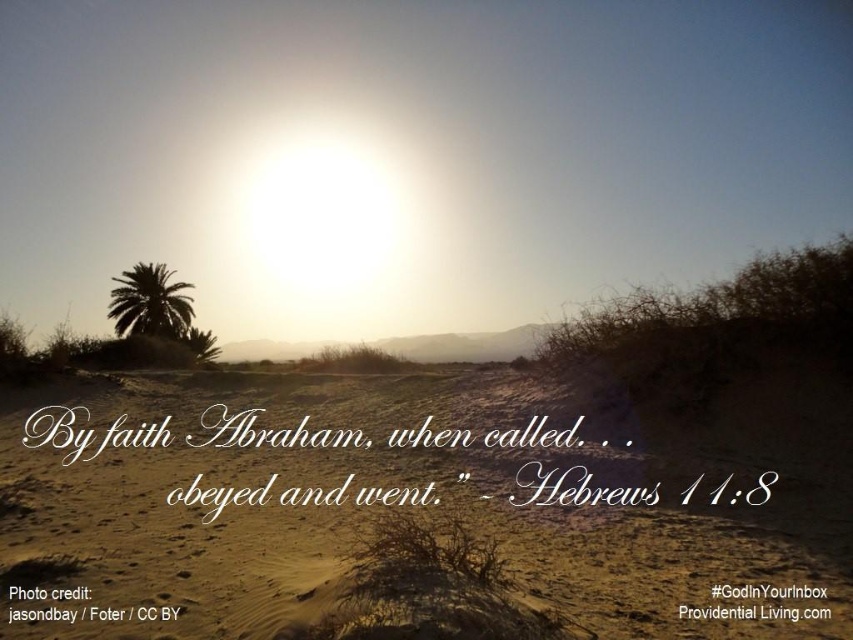
Based on the coordinates provided, which object is located at point (366, 513) in the desert scene?

The point (366, 513) corresponds to the sandy beige desert at center.

You are a hiker who wants to take a photo of the silhouette palm tree at left from the sandy beige desert at center. Which direction should you face to ensure the palm tree is fully visible in your frame?

The silhouette palm tree at left is taller than the sandy beige desert at center, so facing towards the silhouette palm tree at left from the sandy beige desert at center will ensure it is fully visible.